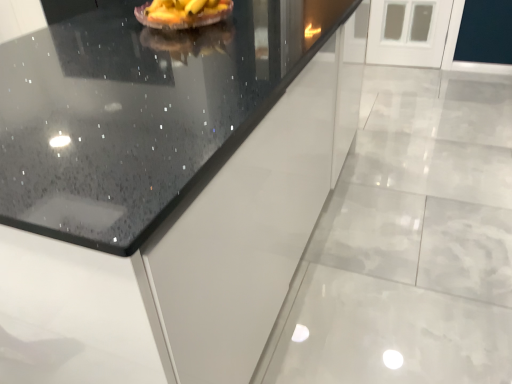
Where is `black granite countertop at center`? black granite countertop at center is located at coordinates (139, 112).

Image resolution: width=512 pixels, height=384 pixels. Describe the element at coordinates (139, 112) in the screenshot. I see `black granite countertop at center` at that location.

The image size is (512, 384). What do you see at coordinates (186, 12) in the screenshot?
I see `yellow matte cake at upper center` at bounding box center [186, 12].

Where is `yellow matte cake at upper center`? The image size is (512, 384). yellow matte cake at upper center is located at coordinates (186, 12).

Locate an element on the screen. The image size is (512, 384). black granite countertop at center is located at coordinates (139, 112).

In the image, is black granite countertop at center on the left side or the right side of yellow matte cake at upper center?

black granite countertop at center is positioned on yellow matte cake at upper center's right side.

Which object is closer to the camera taking this photo, black granite countertop at center or yellow matte cake at upper center?

black granite countertop at center.

Does point (130, 126) appear closer or farther from the camera than point (155, 14)?

Point (130, 126) is closer to the camera than point (155, 14).

From the image's perspective, is black granite countertop at center located above or below yellow matte cake at upper center?

Clearly, from the image's perspective, black granite countertop at center is below yellow matte cake at upper center.

From a real-world perspective, is black granite countertop at center physically below yellow matte cake at upper center?

Yes, from a real-world perspective, black granite countertop at center is beneath yellow matte cake at upper center.

Based on the photo, which object is thinner, black granite countertop at center or yellow matte cake at upper center?

yellow matte cake at upper center.

Is black granite countertop at center shorter than yellow matte cake at upper center?

No, black granite countertop at center is not shorter than yellow matte cake at upper center.

Can you confirm if black granite countertop at center is bigger than yellow matte cake at upper center?

Correct, black granite countertop at center is larger in size than yellow matte cake at upper center.

Is black granite countertop at center located outside yellow matte cake at upper center?

Yes, black granite countertop at center is outside of yellow matte cake at upper center.

Is black granite countertop at center next to yellow matte cake at upper center and touching it?

No, black granite countertop at center is not making contact with yellow matte cake at upper center.

Is black granite countertop at center facing towards yellow matte cake at upper center?

No, black granite countertop at center does not turn towards yellow matte cake at upper center.

You are a GUI agent. You are given a task and a screenshot of the screen. Output one action in this format:
    pyautogui.click(x=<x>, y=<y>)
    Task: Click on the countertop that is on the right side of yellow matte cake at upper center
    This screenshot has height=384, width=512.
    Given the screenshot: What is the action you would take?
    pyautogui.click(x=139, y=112)

Is yellow matte cake at upper center to the right of black granite countertop at center from the viewer's perspective?

No, yellow matte cake at upper center is not to the right of black granite countertop at center.

Is the position of yellow matte cake at upper center more distant than that of black granite countertop at center?

Yes.

Does point (217, 8) appear closer or farther from the camera than point (138, 52)?

Clearly, point (217, 8) is more distant from the camera than point (138, 52).

From the image's perspective, between yellow matte cake at upper center and black granite countertop at center, who is located below?

From the image's view, black granite countertop at center is below.

From a real-world perspective, which object rests below the other?

black granite countertop at center is physically lower.

Which of these two, yellow matte cake at upper center or black granite countertop at center, is wider?

Wider between the two is black granite countertop at center.

Between yellow matte cake at upper center and black granite countertop at center, which one has less height?

yellow matte cake at upper center is shorter.

Based on their sizes in the image, would you say yellow matte cake at upper center is bigger or smaller than black granite countertop at center?

Clearly, yellow matte cake at upper center is smaller in size than black granite countertop at center.

Based on the photo, is yellow matte cake at upper center inside the boundaries of black granite countertop at center, or outside?

The correct answer is: outside.

Is yellow matte cake at upper center directly adjacent to black granite countertop at center?

No, yellow matte cake at upper center is not in contact with black granite countertop at center.

Could you tell me if yellow matte cake at upper center is turned towards black granite countertop at center?

No, yellow matte cake at upper center is not turned towards black granite countertop at center.

Measure the distance from yellow matte cake at upper center to black granite countertop at center.

The distance of yellow matte cake at upper center from black granite countertop at center is 36.19 centimeters.

At what (x,y) coordinates should I click in order to perform the action: click on food above the black granite countertop at center (from the image's perspective). Please return your answer as a coordinate pair (x, y). Looking at the image, I should click on (186, 12).

Locate an element on the screen. This screenshot has width=512, height=384. countertop that is below the yellow matte cake at upper center (from the image's perspective) is located at coordinates (139, 112).

There is a black granite countertop at center. At what (x,y) coordinates should I click in order to perform the action: click on food above it (from a real-world perspective). Please return your answer as a coordinate pair (x, y). Looking at the image, I should click on 186,12.